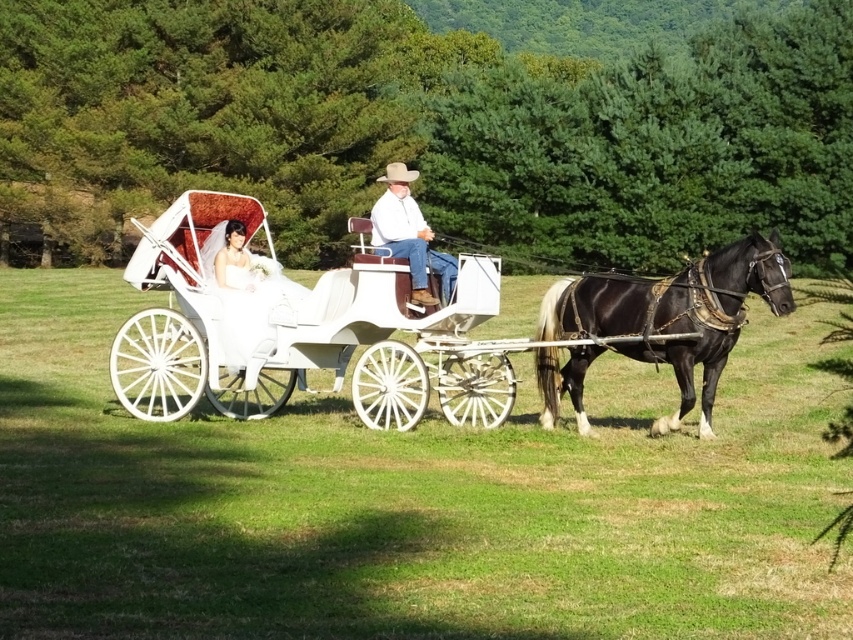
What do you see at coordinates (299, 328) in the screenshot? I see `white polished wood cart at center` at bounding box center [299, 328].

Does white polished wood cart at center have a larger size compared to black glossy horse at right?

No.

Identify the location of white polished wood cart at center. The width and height of the screenshot is (853, 640). (299, 328).

Can you confirm if white polished wood cart at center is smaller than white leather coach at center?

Yes, white polished wood cart at center is smaller than white leather coach at center.

What do you see at coordinates (299, 328) in the screenshot? I see `white polished wood cart at center` at bounding box center [299, 328].

Find the location of `white polished wood cart at center`. white polished wood cart at center is located at coordinates (299, 328).

Between black glossy horse at right and white leather coach at center, which one has more height?

With more height is white leather coach at center.

Is black glossy horse at right below white leather coach at center?

Yes, black glossy horse at right is below white leather coach at center.

Between point (665, 340) and point (390, 240), which one is positioned behind?

Point (390, 240)

Where is `black glossy horse at right`? black glossy horse at right is located at coordinates pyautogui.click(x=675, y=314).